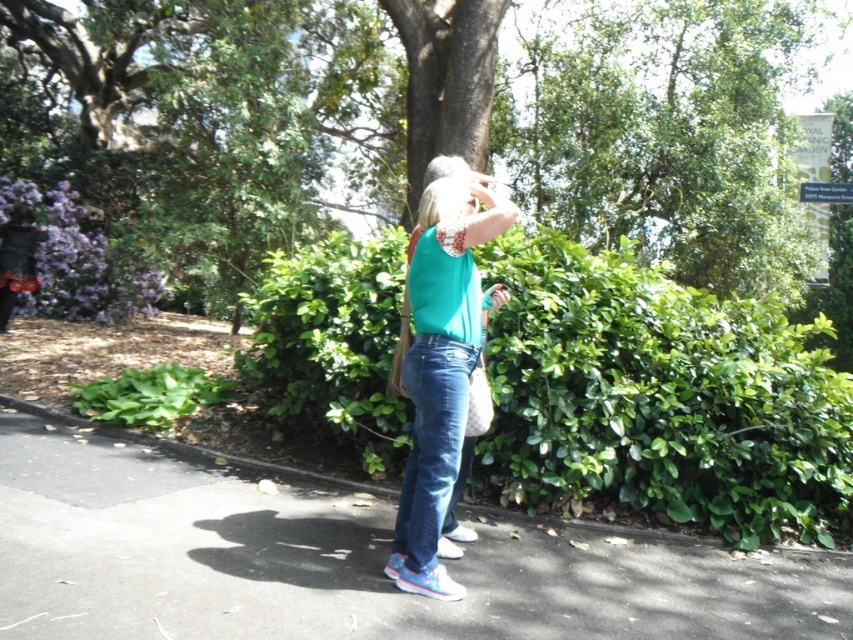
Question: Can you confirm if green leafy tree at center is positioned below black asphalt pavement at center?

Choices:
 (A) yes
 (B) no

Answer: (B)

Question: Which point is farther to the camera?

Choices:
 (A) green leafy hedge at center
 (B) teal fabric at center
 (C) green leafy tree at center

Answer: (C)

Question: Which is farther from the black asphalt pavement at center?

Choices:
 (A) green leafy hedge at center
 (B) green leafy tree at center
 (C) teal fabric at center
 (D) matte teal tank top at center

Answer: (B)

Question: Does black asphalt pavement at center appear under teal fabric at center?

Choices:
 (A) yes
 (B) no

Answer: (A)

Question: Which object is farther from the camera taking this photo?

Choices:
 (A) black asphalt pavement at center
 (B) matte teal tank top at center

Answer: (B)

Question: Is green leafy tree at center wider than black asphalt pavement at center?

Choices:
 (A) no
 (B) yes

Answer: (B)